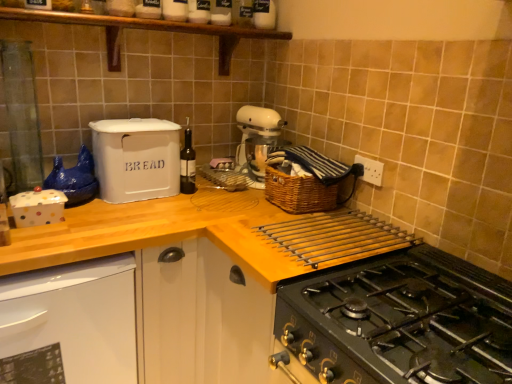
The height and width of the screenshot is (384, 512). In order to click on free space in front of dark glass bottle at center in this screenshot , I will do `click(178, 207)`.